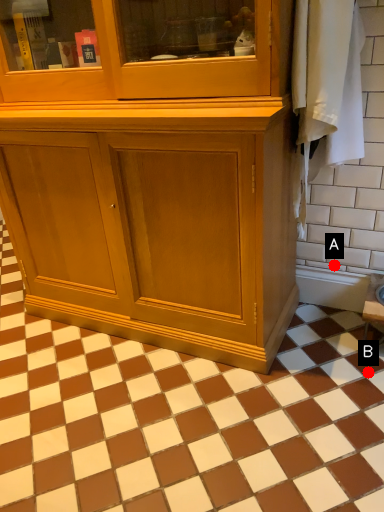
Question: Two points are circled on the image, labeled by A and B beside each circle. Which point is closer to the camera?

Choices:
 (A) A is closer
 (B) B is closer

Answer: (B)